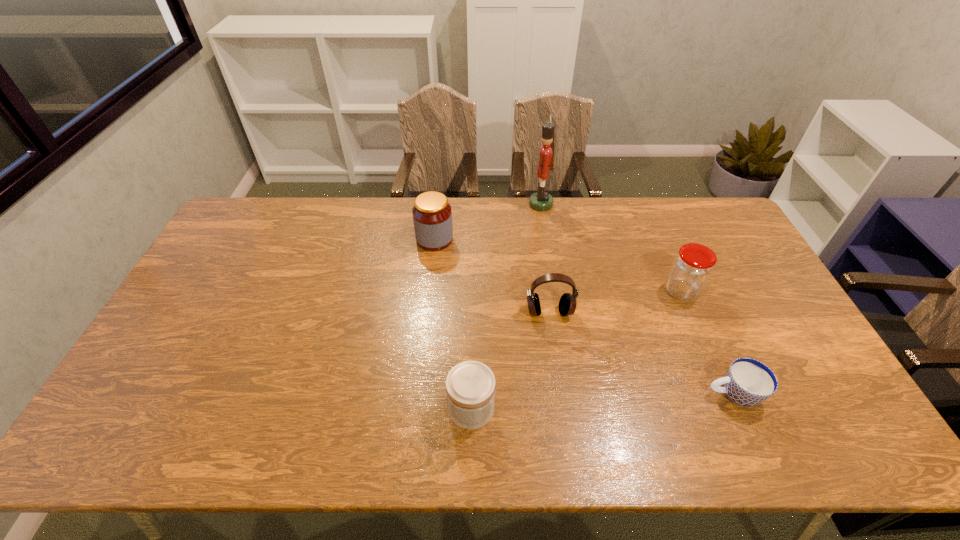
At what (x,y) coordinates should I click in order to perform the action: click on jar that is at the far edge. Please return your answer as a coordinate pair (x, y). The image size is (960, 540). Looking at the image, I should click on (432, 215).

You are a GUI agent. You are given a task and a screenshot of the screen. Output one action in this format:
    pyautogui.click(x=<x>, y=<y>)
    Task: Click on the object present at the near edge
    The width and height of the screenshot is (960, 540).
    Given the screenshot: What is the action you would take?
    pyautogui.click(x=470, y=385)

Find the location of a particular element. free spot at the far edge of the desktop is located at coordinates (612, 207).

The height and width of the screenshot is (540, 960). Identify the location of vacant space at the near edge of the desktop. (715, 446).

Where is `vacant space at the left edge of the desktop`? The image size is (960, 540). vacant space at the left edge of the desktop is located at coordinates (220, 270).

The width and height of the screenshot is (960, 540). I want to click on vacant area at the right edge of the desktop, so pyautogui.click(x=715, y=247).

The height and width of the screenshot is (540, 960). What are the coordinates of `free space at the far left corner` in the screenshot? It's located at (275, 206).

Identify the location of free point at the far right corner. (700, 198).

Locate an element on the screen. This screenshot has height=540, width=960. vacant area that lies between the second farthest object and the shortest object is located at coordinates (584, 316).

The image size is (960, 540). What are the coordinates of `vacant region between the second farthest jar and the shortest object` in the screenshot? It's located at (707, 343).